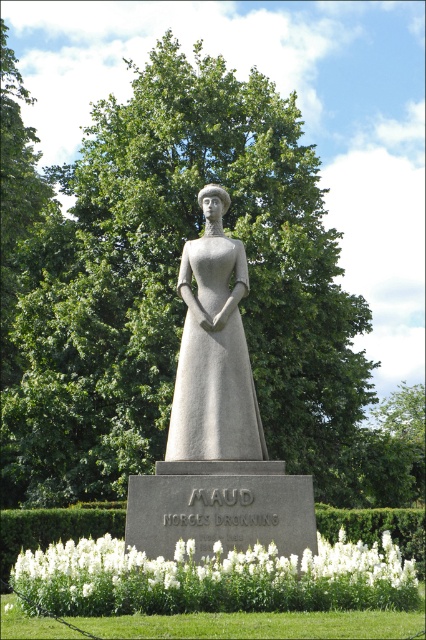
Is gray stone statue at center further to camera compared to gray stone dress at center?

No, it is not.

Who is positioned more to the right, gray stone statue at center or gray stone dress at center?

Positioned to the right is gray stone statue at center.

Where is `gray stone statue at center`? gray stone statue at center is located at coordinates (216, 422).

At what (x,y) coordinates should I click in order to perform the action: click on gray stone statue at center. Please return your answer as a coordinate pair (x, y). Looking at the image, I should click on (216, 422).